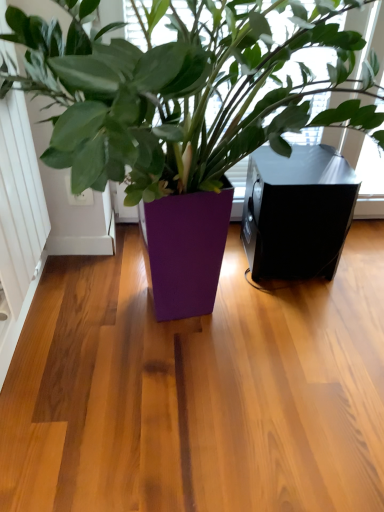
Question: Considering the positions of white matte screen door at left and purple glossy planter at center in the image, is white matte screen door at left bigger or smaller than purple glossy planter at center?

Choices:
 (A) big
 (B) small

Answer: (B)

Question: In terms of width, does white matte screen door at left look wider or thinner when compared to purple glossy planter at center?

Choices:
 (A) wide
 (B) thin

Answer: (B)

Question: Which object is positioned farthest from the purple glossy planter at center?

Choices:
 (A) white matte screen door at left
 (B) black matte speaker at right

Answer: (A)

Question: Considering the real-world distances, which object is farthest from the white matte screen door at left?

Choices:
 (A) black matte speaker at right
 (B) purple glossy planter at center

Answer: (A)